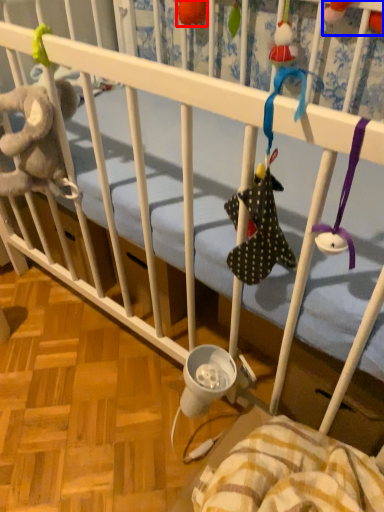
Question: Which object appears farthest to the camera in this image, toy (highlighted by a red box) or toy (highlighted by a blue box)?

Choices:
 (A) toy
 (B) toy

Answer: (A)